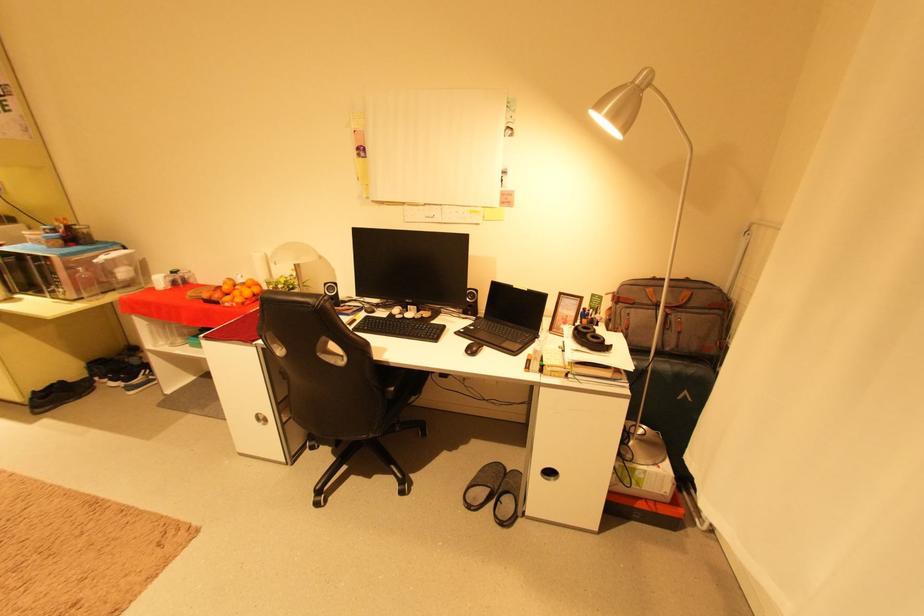
This screenshot has width=924, height=616. What do you see at coordinates (669, 299) in the screenshot?
I see `the brown bag handle` at bounding box center [669, 299].